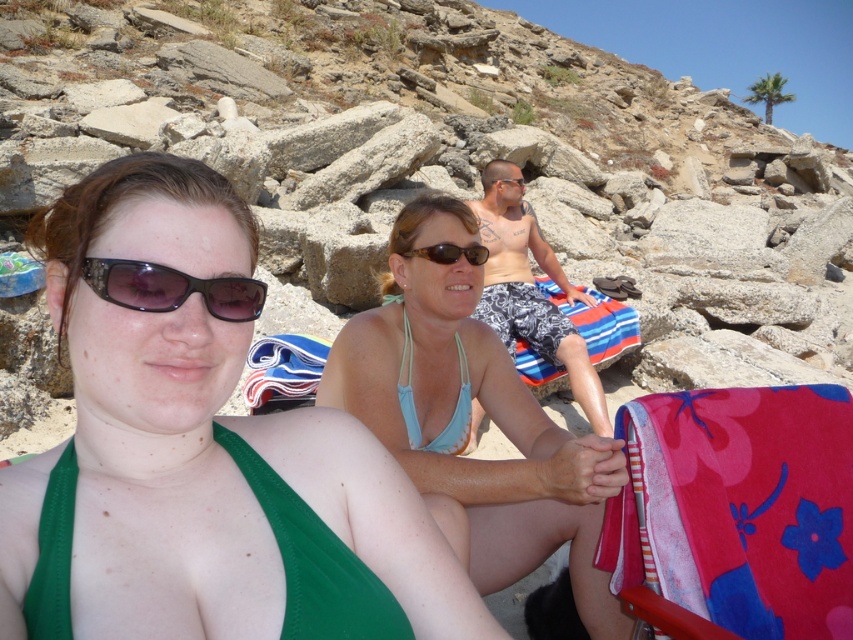
Question: Which object is positioned farthest from the black textured sunglasses at center?

Choices:
 (A) green fabric bikini top at center
 (B) white striped shorts at center

Answer: (B)

Question: Does green fabric bikini top at center appear over blue fabric bikini top at center?

Choices:
 (A) yes
 (B) no

Answer: (B)

Question: Which object appears closest to the camera in this image?

Choices:
 (A) brown matte sunglasses at center
 (B) striped cotton towel at center
 (C) blue fabric bikini top at center
 (D) black textured sunglasses at center

Answer: (D)

Question: Which object is farther from the camera taking this photo?

Choices:
 (A) white striped shorts at center
 (B) light blue fabric bikini top at center
 (C) green fabric bikini top at center

Answer: (A)

Question: Where is pink fabric beach chair at lower right located in relation to white striped shorts at center in the image?

Choices:
 (A) above
 (B) below

Answer: (B)

Question: Is black textured sunglasses at center in front of light blue fabric bikini top at center?

Choices:
 (A) no
 (B) yes

Answer: (B)